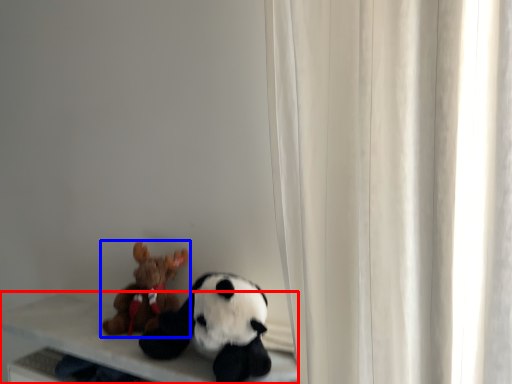
Question: Which object is further to the camera taking this photo, table (highlighted by a red box) or toy (highlighted by a blue box)?

Choices:
 (A) table
 (B) toy

Answer: (B)